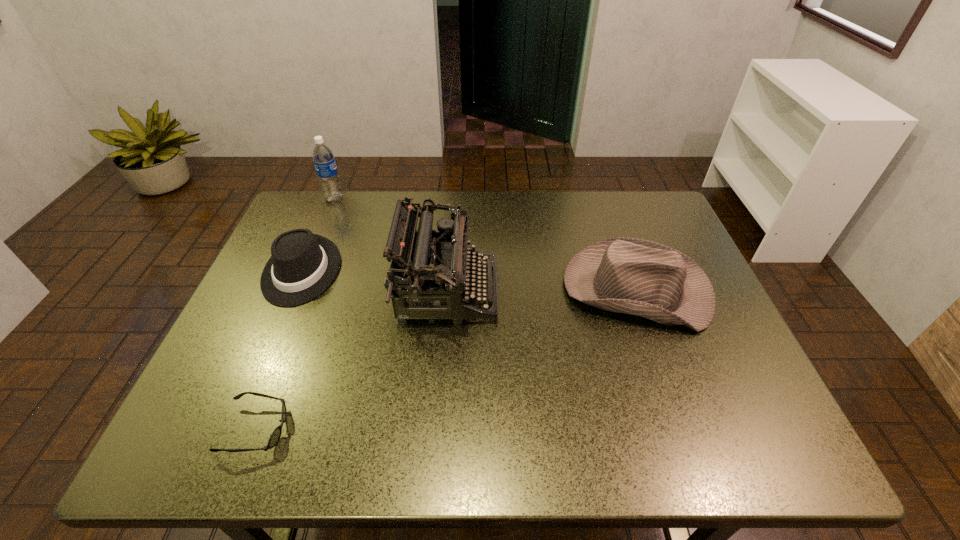
Find the location of a particular element. This screenshot has width=960, height=540. water bottle is located at coordinates (323, 158).

Locate an element on the screen. This screenshot has width=960, height=540. typewriter is located at coordinates (443, 269).

The width and height of the screenshot is (960, 540). What are the coordinates of `the right fedora` in the screenshot? It's located at (633, 276).

You are a GUI agent. You are given a task and a screenshot of the screen. Output one action in this format:
    pyautogui.click(x=<x>, y=<y>)
    Task: Click on the taller fedora
    The image size is (960, 540).
    Given the screenshot: What is the action you would take?
    pyautogui.click(x=633, y=276)

Locate an element on the screen. The image size is (960, 540). the left fedora is located at coordinates (302, 265).

At what (x,y) coordinates should I click in order to perform the action: click on the fourth tallest object. Please return your answer as a coordinate pair (x, y). The image size is (960, 540). Looking at the image, I should click on (302, 265).

The width and height of the screenshot is (960, 540). I want to click on sunglasses, so click(275, 436).

Locate an element on the screen. the shortest object is located at coordinates (275, 436).

This screenshot has height=540, width=960. I want to click on blank area located on the front of the water bottle, so click(327, 215).

The image size is (960, 540). In order to click on vacant space located on the keyboard of the typewriter in this screenshot , I will do `click(593, 291)`.